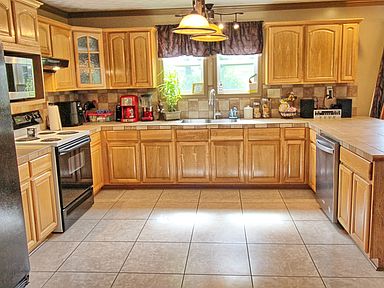
Can you point out all where you would wash the dishes in this image? Your answer should be formatted as a list of tuples, i.e. [(x1, y1), (x2, y2), ...], where each tuple contains the x and y coordinates of a point satisfying the conditions above.

[(221, 121), (199, 120)]